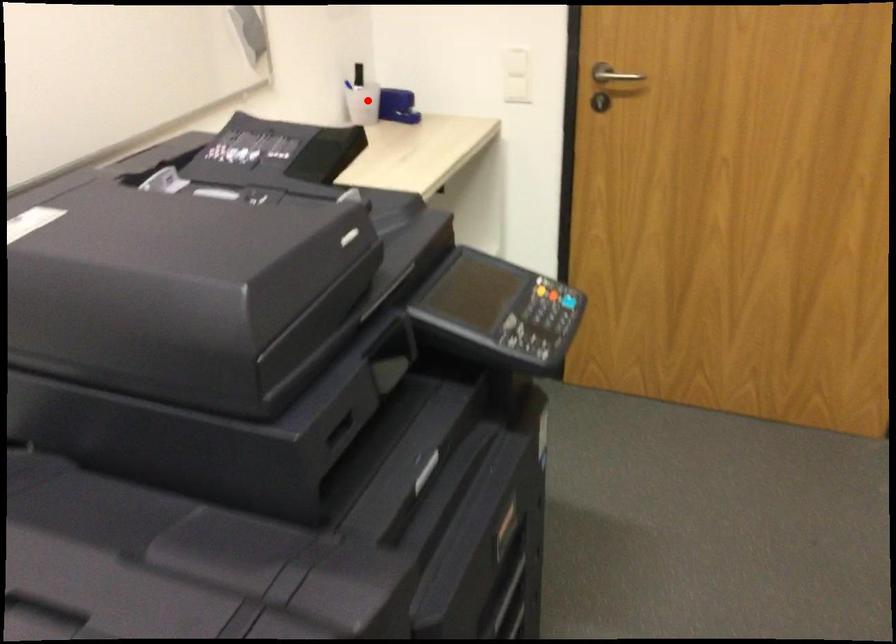
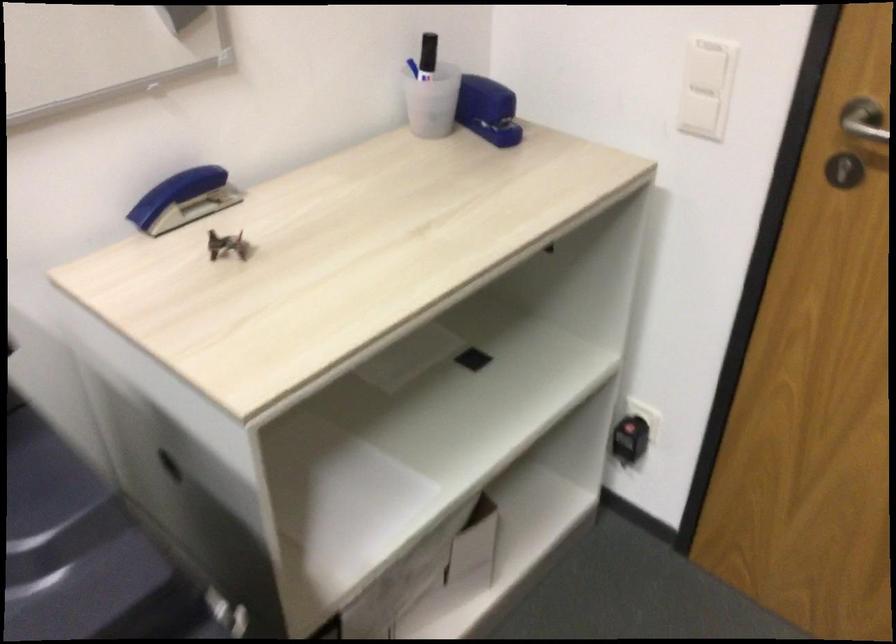
Question: I am providing you with two images of the same scene from different viewpoints. A red point is shown in image1. For the corresponding object point in image2, is it positioned nearer or farther from the camera?

Choices:
 (A) Nearer
 (B) Farther

Answer: (A)